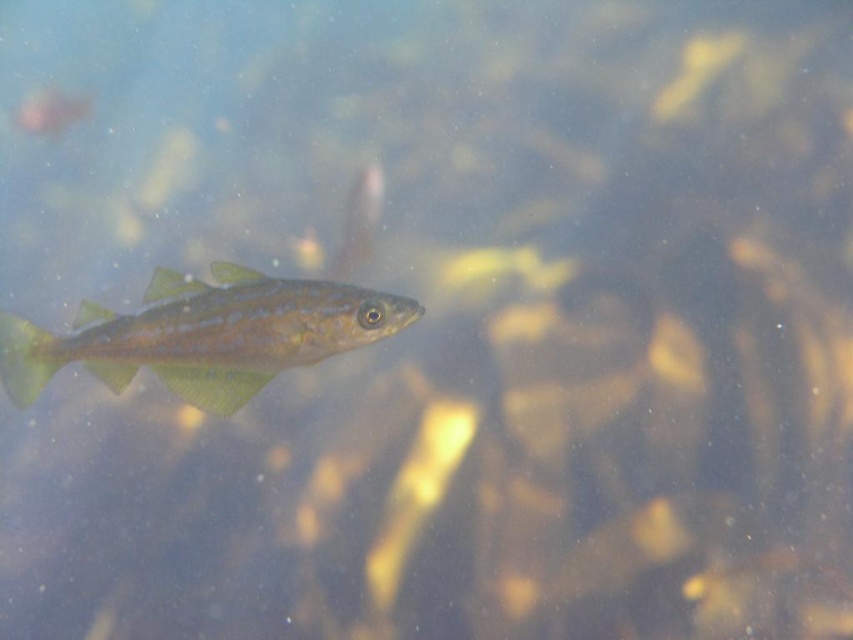
Question: From the image, what is the correct spatial relationship of translucent yellow-green fish at upper right in relation to translucent greenish-yellow fish at upper left?

Choices:
 (A) above
 (B) below

Answer: (A)

Question: Can you confirm if green translucent fish at center is positioned to the right of translucent greenish-yellow fish at upper left?

Choices:
 (A) no
 (B) yes

Answer: (B)

Question: Considering the real-world distances, which object is closest to the translucent yellow-green fish at upper right?

Choices:
 (A) translucent greenish-yellow fish at center
 (B) translucent greenish-yellow fish at upper left
 (C) green translucent fish at center

Answer: (A)

Question: Does green translucent fish at center appear on the right side of translucent greenish-yellow fish at upper left?

Choices:
 (A) yes
 (B) no

Answer: (A)

Question: Which object appears farthest from the camera in this image?

Choices:
 (A) green translucent fish at center
 (B) translucent yellow-green fish at upper right
 (C) translucent greenish-yellow fish at upper left

Answer: (C)

Question: Based on their relative distances, which object is farther from the translucent yellow-green fish at upper right?

Choices:
 (A) translucent greenish-yellow fish at upper left
 (B) translucent greenish-yellow fish at center
 (C) green translucent fish at center

Answer: (A)